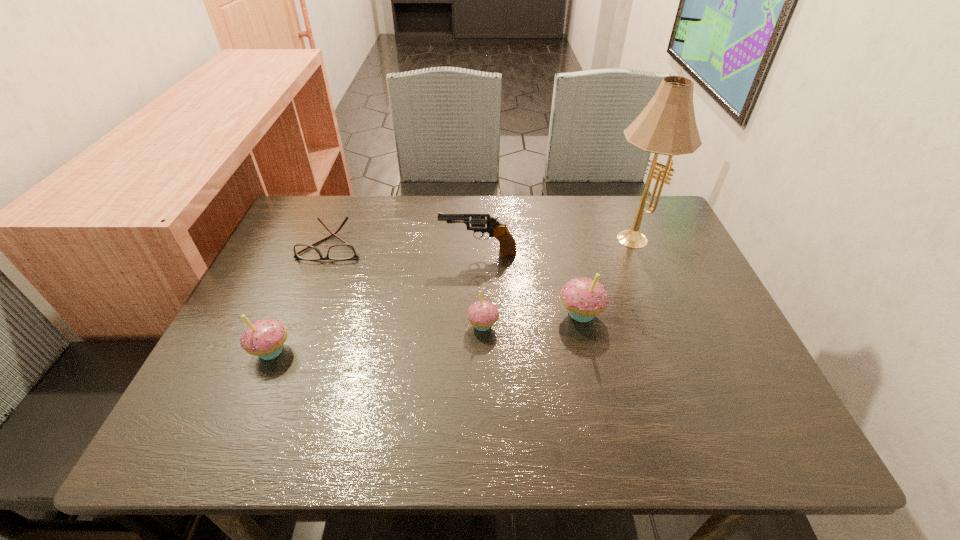
What are the coordinates of `cupcake that is at the left edge` in the screenshot? It's located at (264, 338).

Locate an element on the screen. spectacles that is at the left edge is located at coordinates (344, 251).

Locate an element on the screen. This screenshot has height=540, width=960. object that is at the right edge is located at coordinates (667, 125).

At what (x,y) coordinates should I click in order to perform the action: click on object at the far left corner. Please return your answer as a coordinate pair (x, y). Image resolution: width=960 pixels, height=540 pixels. Looking at the image, I should click on (344, 251).

This screenshot has height=540, width=960. What are the coordinates of `object present at the near left corner` in the screenshot? It's located at (264, 338).

Image resolution: width=960 pixels, height=540 pixels. What are the coordinates of `object positioned at the far right corner` in the screenshot? It's located at (667, 125).

This screenshot has height=540, width=960. Find the location of `free space at the far edge of the desktop`. free space at the far edge of the desktop is located at coordinates (549, 197).

Where is `free space at the near edge`? This screenshot has height=540, width=960. free space at the near edge is located at coordinates (350, 400).

In order to click on free spot at the left edge of the desktop in this screenshot , I will do `click(320, 282)`.

This screenshot has width=960, height=540. I want to click on vacant area at the far left corner of the desktop, so click(293, 218).